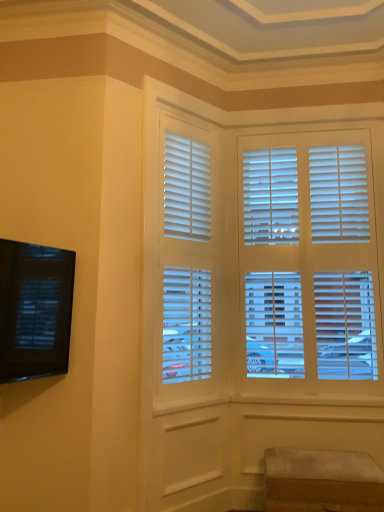
Question: Considering the relative sizes of suede ottoman at lower right and black glossy tv at left in the image provided, is suede ottoman at lower right taller than black glossy tv at left?

Choices:
 (A) no
 (B) yes

Answer: (A)

Question: Is suede ottoman at lower right shorter than black glossy tv at left?

Choices:
 (A) yes
 (B) no

Answer: (A)

Question: From the image's perspective, is suede ottoman at lower right over black glossy tv at left?

Choices:
 (A) yes
 (B) no

Answer: (B)

Question: Is suede ottoman at lower right positioned in front of black glossy tv at left?

Choices:
 (A) yes
 (B) no

Answer: (B)

Question: Is black glossy tv at left at the back of suede ottoman at lower right?

Choices:
 (A) yes
 (B) no

Answer: (B)

Question: From a real-world perspective, is suede ottoman at lower right over black glossy tv at left?

Choices:
 (A) no
 (B) yes

Answer: (A)

Question: Does white matte blinds at center lie behind black glossy tv at left?

Choices:
 (A) no
 (B) yes

Answer: (B)

Question: Does white matte blinds at center lie in front of black glossy tv at left?

Choices:
 (A) yes
 (B) no

Answer: (B)

Question: From the image's perspective, would you say white matte blinds at center is shown under black glossy tv at left?

Choices:
 (A) yes
 (B) no

Answer: (B)

Question: Could you tell me if white matte blinds at center is facing black glossy tv at left?

Choices:
 (A) yes
 (B) no

Answer: (B)

Question: Does white matte blinds at center have a smaller size compared to black glossy tv at left?

Choices:
 (A) yes
 (B) no

Answer: (B)

Question: Is white matte blinds at center outside of black glossy tv at left?

Choices:
 (A) yes
 (B) no

Answer: (A)

Question: Is white matte blinds at center located within suede ottoman at lower right?

Choices:
 (A) yes
 (B) no

Answer: (B)